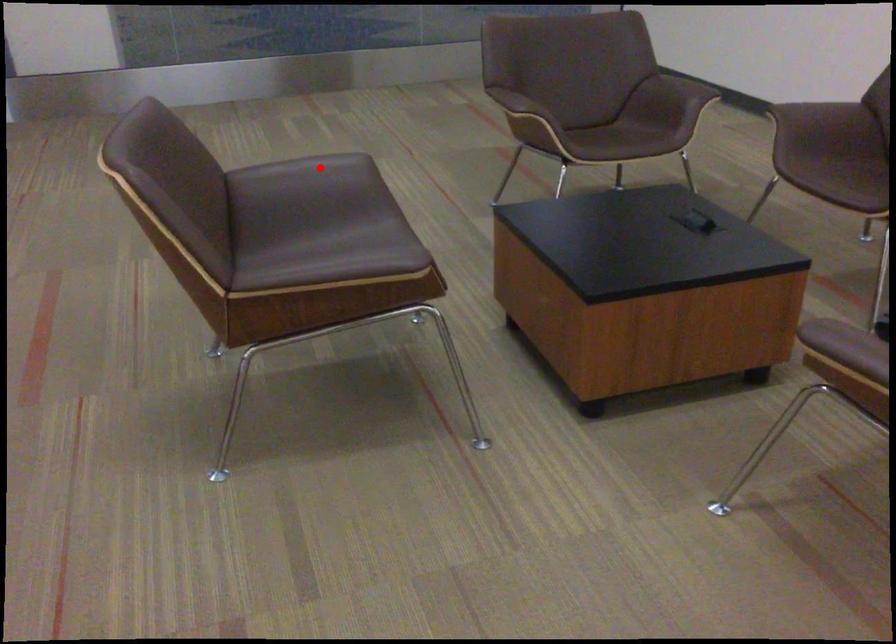
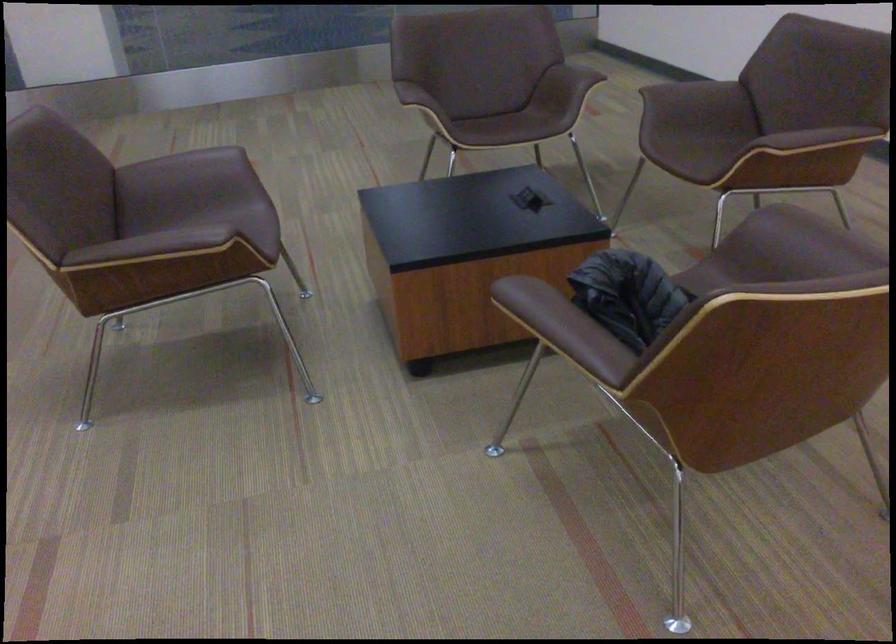
Question: I am providing you with two images of the same scene from different viewpoints. Given a red point in image1, look at the same physical point in image2. Is it:

Choices:
 (A) Closer to the viewpoint
 (B) Farther from the viewpoint

Answer: (B)